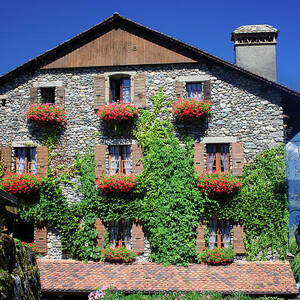
The height and width of the screenshot is (300, 300). Find the location of `basket`. basket is located at coordinates (111, 183).